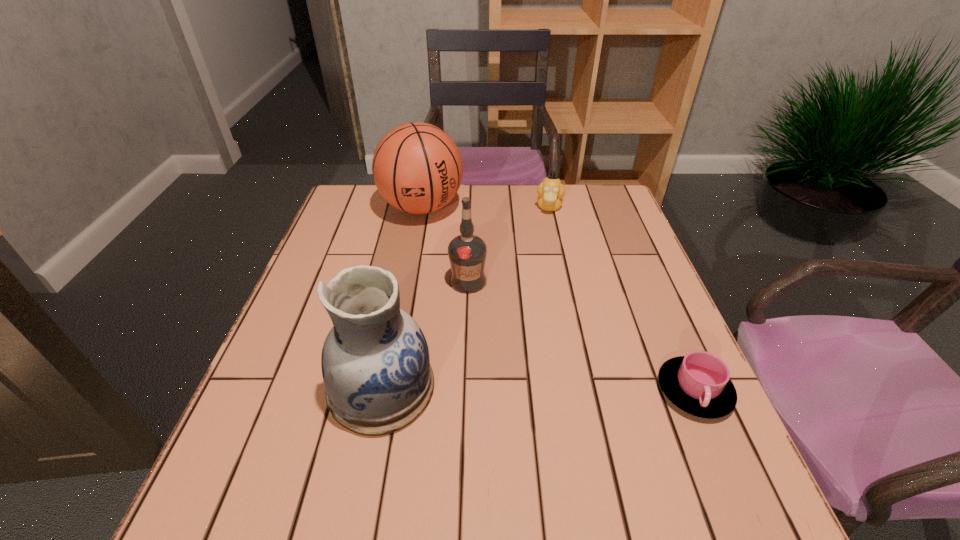
In order to click on pottery located at the near edge in this screenshot , I will do `click(375, 362)`.

Locate an element on the screen. cup at the near edge is located at coordinates (698, 383).

At what (x,y) coordinates should I click in order to perform the action: click on pottery that is at the left edge. Please return your answer as a coordinate pair (x, y). Image resolution: width=960 pixels, height=540 pixels. Looking at the image, I should click on (375, 362).

Image resolution: width=960 pixels, height=540 pixels. In order to click on basketball that is at the left edge in this screenshot , I will do `click(417, 168)`.

Where is `object that is at the right edge`? This screenshot has width=960, height=540. object that is at the right edge is located at coordinates (698, 383).

The height and width of the screenshot is (540, 960). I want to click on object that is at the far left corner, so click(x=417, y=168).

The height and width of the screenshot is (540, 960). Find the location of `object positioned at the near left corner`. object positioned at the near left corner is located at coordinates pos(375,362).

The height and width of the screenshot is (540, 960). I want to click on object that is at the near right corner, so click(x=698, y=383).

In the image, there is a desktop. Identify the location of vacant space at the far edge. (491, 199).

This screenshot has width=960, height=540. In the image, there is a desktop. What are the coordinates of `free space at the near edge` in the screenshot? It's located at (452, 431).